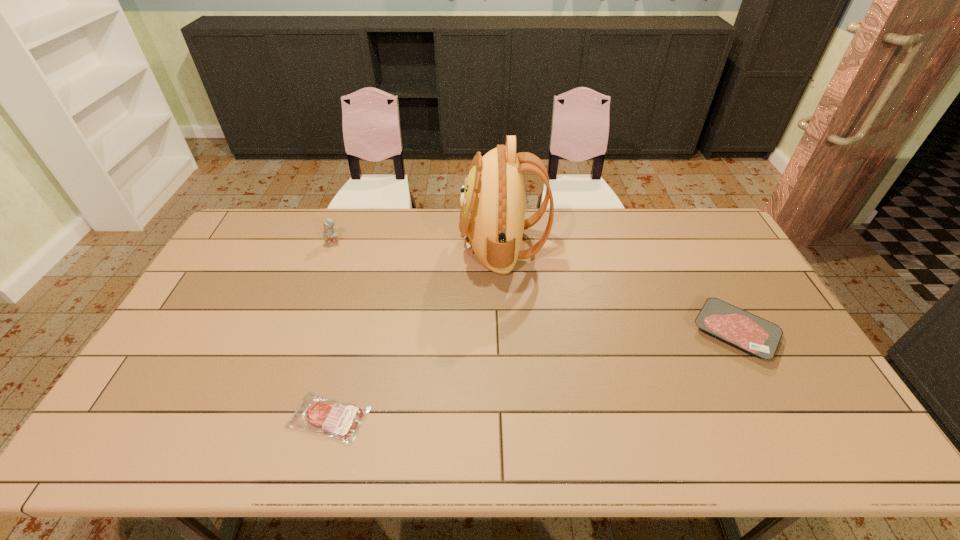
Image resolution: width=960 pixels, height=540 pixels. I want to click on backpack, so (492, 219).

I want to click on the tallest object, so click(492, 219).

Identify the location of the second tallest object. (330, 235).

In order to click on teddy bear in this screenshot , I will do `click(330, 235)`.

Locate an element on the screen. The image size is (960, 540). the second nearest object is located at coordinates (754, 335).

At what (x,y) coordinates should I click in order to perform the action: click on the taller steak. Please return your answer as a coordinate pair (x, y). This screenshot has width=960, height=540. Looking at the image, I should click on (754, 335).

Identify the location of the third object from right to left. (340, 421).

The image size is (960, 540). I want to click on the nearer steak, so click(x=340, y=421).

The image size is (960, 540). Find the location of `free region located 0.350m on the front-facing side of the tallest object`. free region located 0.350m on the front-facing side of the tallest object is located at coordinates (361, 245).

At what (x,y) coordinates should I click in order to perform the action: click on vacant space located 0.280m on the front-facing side of the tallest object. Please return your answer as a coordinate pair (x, y). Looking at the image, I should click on (381, 245).